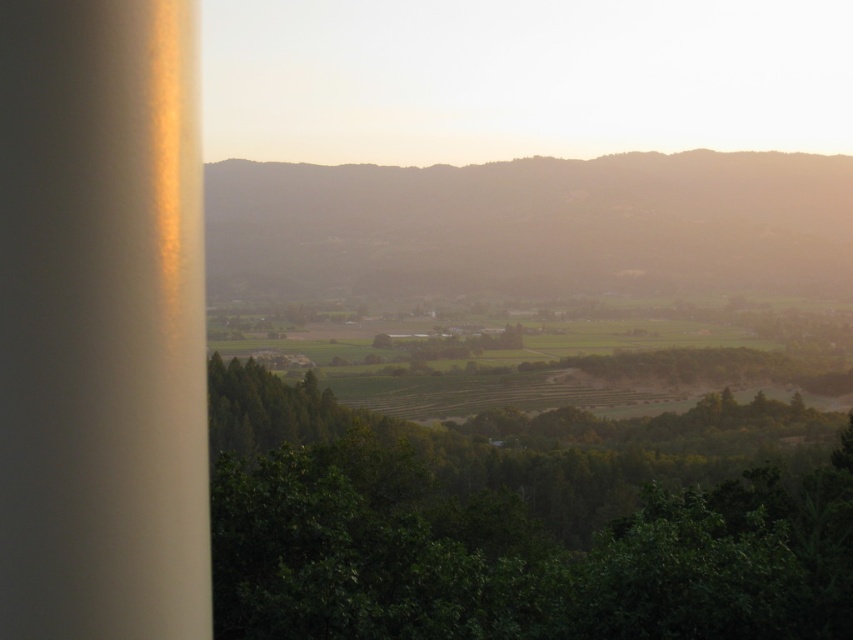
Question: Which object is farther from the camera taking this photo?

Choices:
 (A) green grassy hillside at center
 (B) green leafy tree at center

Answer: (A)

Question: Which point appears farthest from the camera in this image?

Choices:
 (A) (508, 445)
 (B) (496, 209)

Answer: (B)

Question: Is green leafy tree at center smaller than green grassy hillside at center?

Choices:
 (A) no
 (B) yes

Answer: (B)

Question: Among these points, which one is farthest from the camera?

Choices:
 (A) (799, 570)
 (B) (549, 204)

Answer: (B)

Question: Is the position of green leafy tree at center less distant than that of green grassy hillside at center?

Choices:
 (A) no
 (B) yes

Answer: (B)

Question: Is green leafy tree at center to the left of green grassy hillside at center from the viewer's perspective?

Choices:
 (A) no
 (B) yes

Answer: (A)